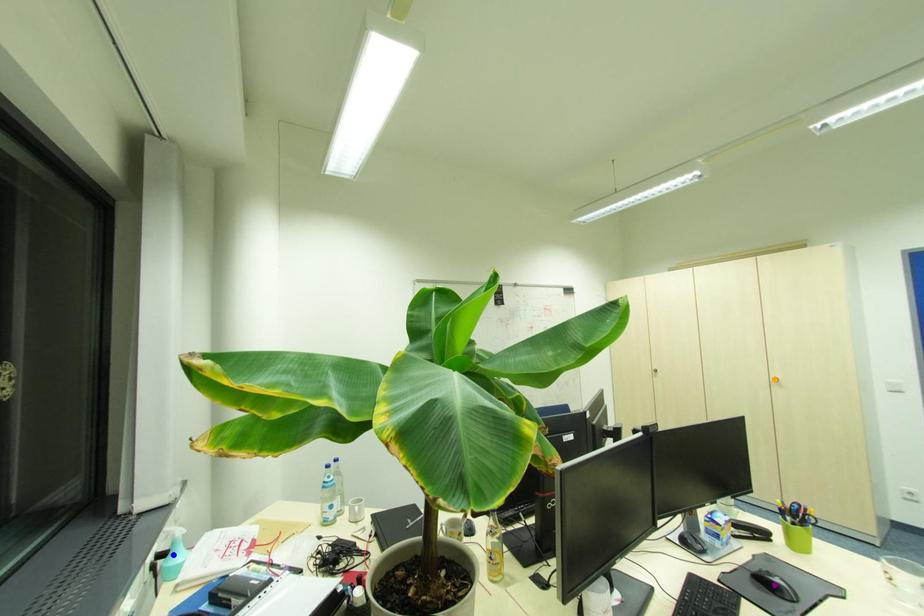
Order these from farthest to nearest:
blue point | orange point | purple point

orange point, blue point, purple point